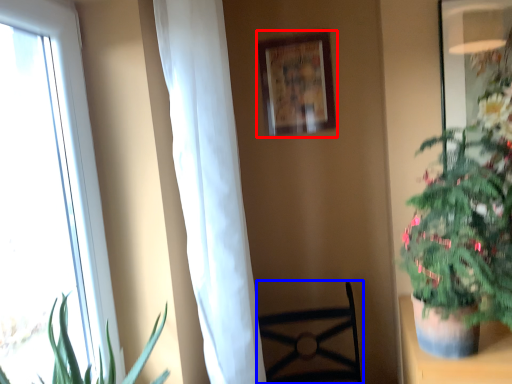
Question: Which of the following is the closest to the observer, picture frame (highlighted by a red box) or furniture (highlighted by a blue box)?

Choices:
 (A) picture frame
 (B) furniture

Answer: (B)